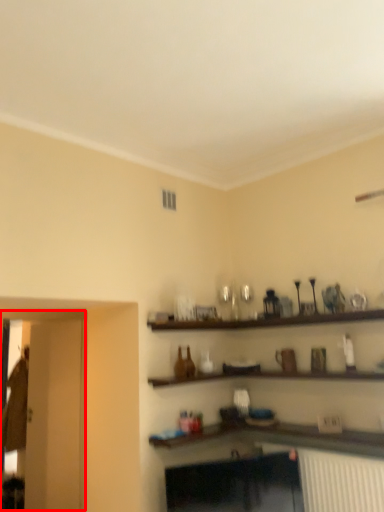
Question: Observing the image, what is the correct spatial positioning of glass door (annotated by the red box) in reference to glass door?

Choices:
 (A) left
 (B) right

Answer: (B)